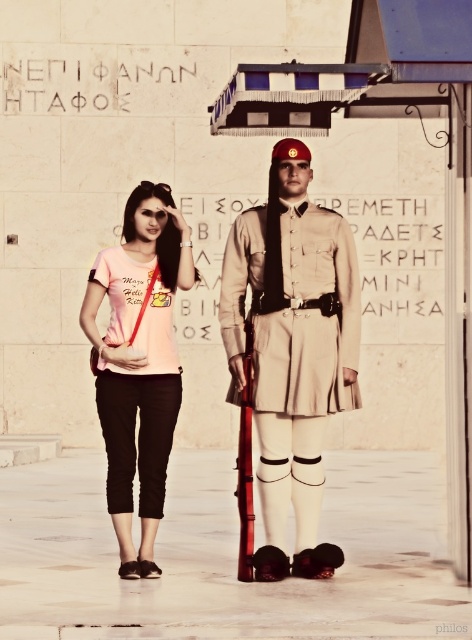
Question: Considering the real-world distances, which object is closest to the light beige fabric uniform at center?

Choices:
 (A) pink matte t-shirt at center
 (B) khaki uniform at center

Answer: (B)

Question: Does khaki uniform at center lie in front of pink matte t-shirt at center?

Choices:
 (A) no
 (B) yes

Answer: (B)

Question: Is khaki uniform at center above light beige fabric uniform at center?

Choices:
 (A) no
 (B) yes

Answer: (A)

Question: Is khaki uniform at center below light beige fabric uniform at center?

Choices:
 (A) yes
 (B) no

Answer: (A)

Question: Which point appears closest to the camera in this image?

Choices:
 (A) (102, 380)
 (B) (338, 353)
 (C) (352, 390)

Answer: (A)

Question: Which point is closer to the camera?

Choices:
 (A) (269, 516)
 (B) (167, 230)

Answer: (A)